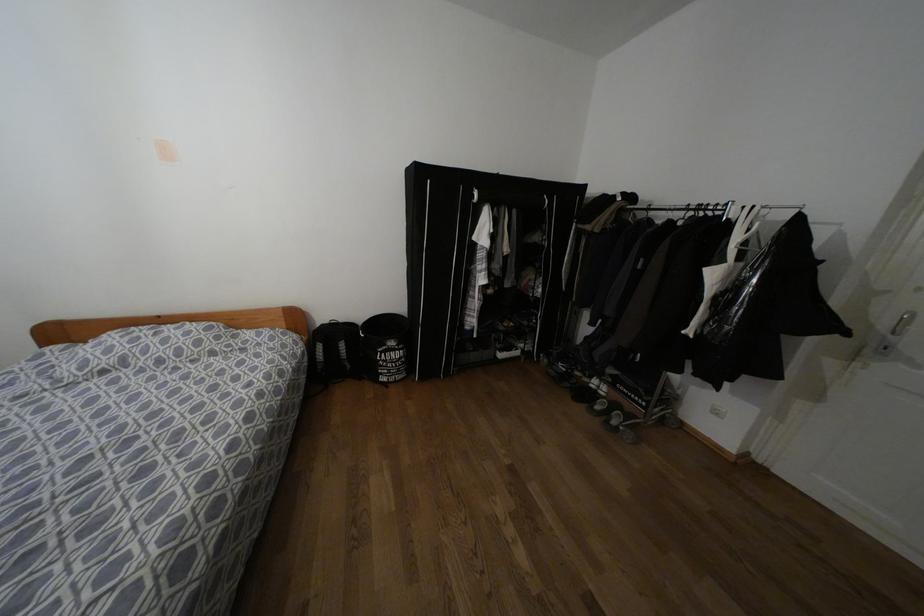
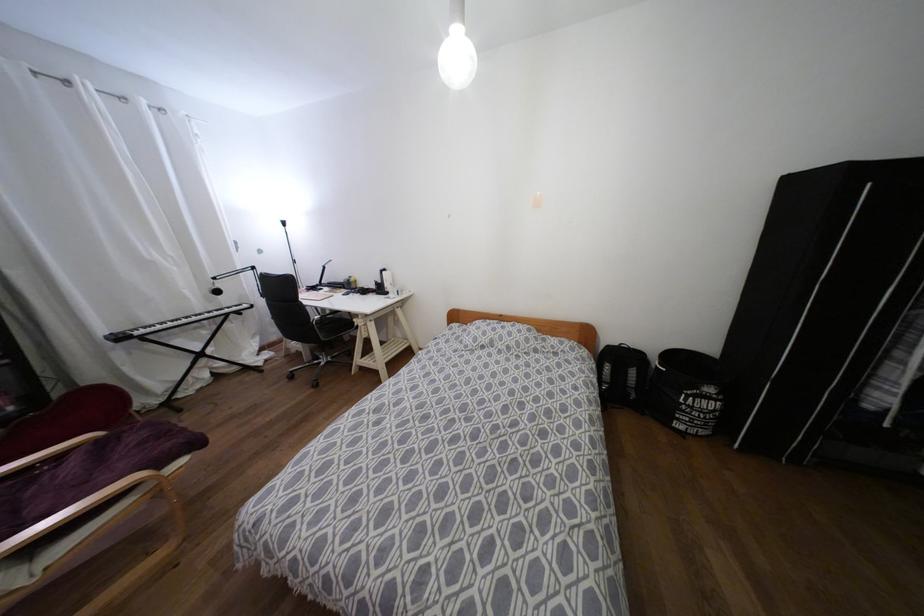
Question: The camera is either moving clockwise (left) or counter-clockwise (right) around the object. The first image is from the beginning of the video and the second image is from the end. Is the camera moving left or right when shooting the video?

Choices:
 (A) Left
 (B) Right

Answer: (B)